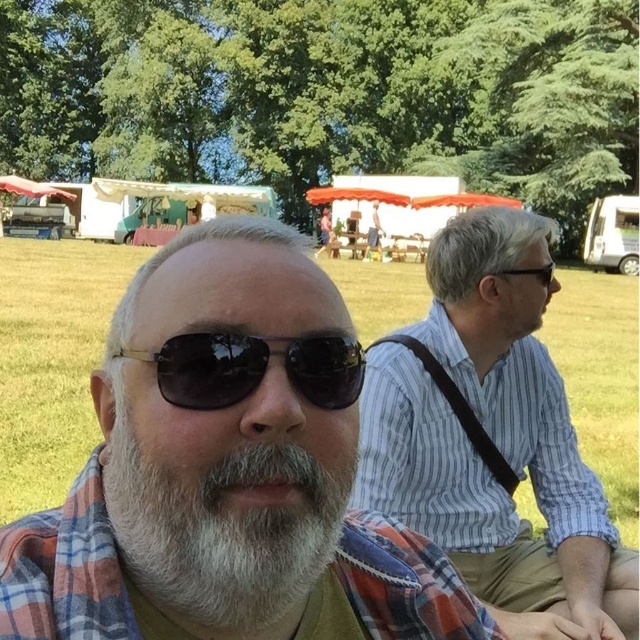
Does plaid fabric shirt at center appear on the right side of metallic aviator sunglasses at center?

No, plaid fabric shirt at center is not to the right of metallic aviator sunglasses at center.

Can you confirm if plaid fabric shirt at center is positioned below metallic aviator sunglasses at center?

Correct, plaid fabric shirt at center is located below metallic aviator sunglasses at center.

I want to click on plaid fabric shirt at center, so click(x=227, y=467).

Locate an element on the screen. The width and height of the screenshot is (640, 640). plaid fabric shirt at center is located at coordinates (227, 467).

Is plaid fabric shirt at center above white matte beard at center?

Actually, plaid fabric shirt at center is below white matte beard at center.

Can you confirm if plaid fabric shirt at center is positioned below white matte beard at center?

→ Indeed, plaid fabric shirt at center is positioned under white matte beard at center.

Between point (236, 516) and point (296, 518), which one is positioned in front?

Point (236, 516)

This screenshot has width=640, height=640. I want to click on plaid fabric shirt at center, so click(227, 467).

The height and width of the screenshot is (640, 640). Describe the element at coordinates (227, 467) in the screenshot. I see `plaid fabric shirt at center` at that location.

Is plaid fabric shirt at center further to camera compared to blue striped shirt at right?

No, it is not.

Does point (257, 515) come closer to viewer compared to point (460, 509)?

Yes, it is.

Where is `plaid fabric shirt at center`? The width and height of the screenshot is (640, 640). plaid fabric shirt at center is located at coordinates (227, 467).